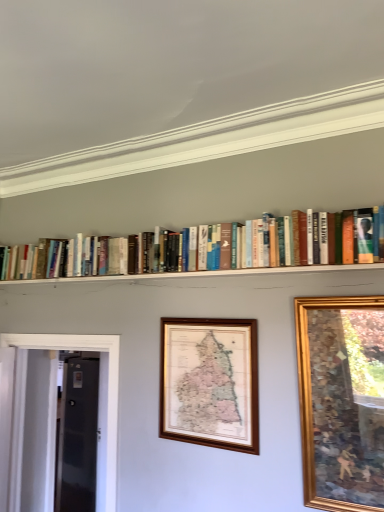
Question: Is gold wooden picture frame at upper right, marked as the 2th picture frame in a back-to-front arrangement, oriented towards wooden map at center, the 2th picture frame in the right-to-left sequence?

Choices:
 (A) no
 (B) yes

Answer: (A)

Question: Considering the relative sizes of gold wooden picture frame at upper right, which ranks as the 2th picture frame in left-to-right order, and wooden map at center, the 2th picture frame in the right-to-left sequence, in the image provided, is gold wooden picture frame at upper right, which ranks as the 2th picture frame in left-to-right order, smaller than wooden map at center, the 2th picture frame in the right-to-left sequence,?

Choices:
 (A) no
 (B) yes

Answer: (A)

Question: From a real-world perspective, is gold wooden picture frame at upper right, which is the first picture frame in front-to-back order, positioned over wooden map at center, marked as the 1th picture frame in a back-to-front arrangement, based on gravity?

Choices:
 (A) yes
 (B) no

Answer: (B)

Question: Is gold wooden picture frame at upper right, which ranks as the 2th picture frame in left-to-right order, positioned before wooden map at center, which is the 2th picture frame from front to back?

Choices:
 (A) no
 (B) yes

Answer: (B)

Question: Would you say wooden map at center, marked as the 1th picture frame in a back-to-front arrangement, is part of gold wooden picture frame at upper right, which is the first picture frame in front-to-back order,'s contents?

Choices:
 (A) no
 (B) yes

Answer: (A)

Question: Is the surface of gold wooden picture frame at upper right, the 1th picture frame positioned from the right, in direct contact with wooden map at center, which is the 2th picture frame from front to back?

Choices:
 (A) no
 (B) yes

Answer: (A)

Question: From a real-world perspective, is gold wooden picture frame at upper right, which ranks as the 2th picture frame in left-to-right order, under transparent glass door at left?

Choices:
 (A) yes
 (B) no

Answer: (B)

Question: Is gold wooden picture frame at upper right, which is the first picture frame in front-to-back order, directly adjacent to transparent glass door at left?

Choices:
 (A) yes
 (B) no

Answer: (B)

Question: From a real-world perspective, is gold wooden picture frame at upper right, marked as the 2th picture frame in a back-to-front arrangement, located higher than transparent glass door at left?

Choices:
 (A) no
 (B) yes

Answer: (B)

Question: Is gold wooden picture frame at upper right, the 1th picture frame positioned from the right, closer to camera compared to transparent glass door at left?

Choices:
 (A) yes
 (B) no

Answer: (A)

Question: Can you confirm if gold wooden picture frame at upper right, which ranks as the 2th picture frame in left-to-right order, is smaller than transparent glass door at left?

Choices:
 (A) yes
 (B) no

Answer: (B)

Question: Is gold wooden picture frame at upper right, marked as the 2th picture frame in a back-to-front arrangement, thinner than transparent glass door at left?

Choices:
 (A) no
 (B) yes

Answer: (A)

Question: Considering the relative positions of transparent glass door at left and hardcover books at upper center in the image provided, is transparent glass door at left in front of hardcover books at upper center?

Choices:
 (A) yes
 (B) no

Answer: (B)